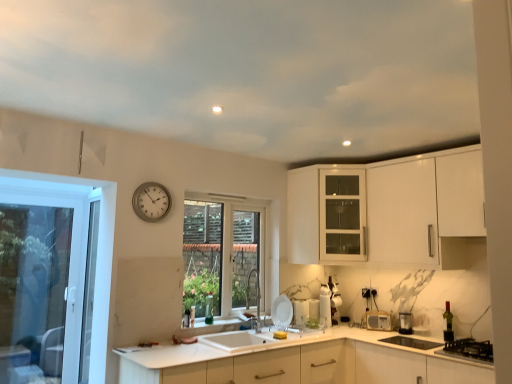
Question: From the image's perspective, is white glossy soap dispenser at center, placed as the 2th appliance when sorted from left to right, positioned above or below silver metallic clock at upper left?

Choices:
 (A) below
 (B) above

Answer: (A)

Question: Would you say white glossy soap dispenser at center, placed as the 2th appliance when sorted from left to right, is to the left or to the right of silver metallic clock at upper left in the picture?

Choices:
 (A) right
 (B) left

Answer: (A)

Question: Estimate the real-world distances between objects in this image. Which object is farther from the clear glass window at center, placed as the second window when sorted from left to right?

Choices:
 (A) white glossy microwave at lower center, which is the 3th appliance in left-to-right order
 (B) black matte gas stove at lower right
 (C) white matte countertop at center
 (D) silver metallic clock at upper left
 (E) green glass bottle at lower right, which is counted as the first wine bottle, starting from the front

Answer: (B)

Question: Which of these objects is positioned farthest from the green glass wine bottle at sink, which is the 1th wine bottle from back to front?

Choices:
 (A) transparent glass door at left, the second window viewed from the right
 (B) white glossy microwave at lower center, which appears as the 2th appliance when viewed from the right
 (C) white glossy plate at sink, placed as the fourth appliance when sorted from right to left
 (D) black matte gas stove at lower right
 (E) clear glass window at center, placed as the second window when sorted from left to right

Answer: (D)